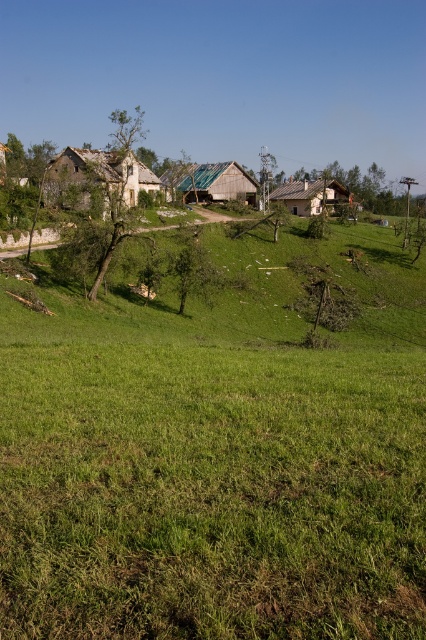
Question: Considering the real-world distances, which object is closest to the wooden hut at center?

Choices:
 (A) green leafy tree at center-left
 (B) rustic wooden hut at center-left

Answer: (B)

Question: Is wooden hut at center below brown wooden house at center?

Choices:
 (A) no
 (B) yes

Answer: (A)

Question: Can you confirm if rustic wooden hut at center-left is positioned below brown wooden house at center?

Choices:
 (A) no
 (B) yes

Answer: (B)

Question: Which of the following is the farthest from the observer?

Choices:
 (A) rustic wooden hut at center-left
 (B) wooden hut at center

Answer: (B)

Question: Estimate the real-world distances between objects in this image. Which object is closer to the green leafy tree at center?

Choices:
 (A) rustic wooden hut at center-left
 (B) brown wooden house at center
 (C) green leafy tree at center-left
 (D) wooden hut at center

Answer: (C)

Question: Is green leafy tree at center-left to the right of brown wooden house at center from the viewer's perspective?

Choices:
 (A) yes
 (B) no

Answer: (B)